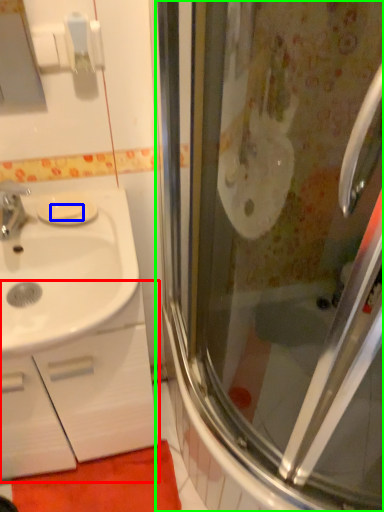
Question: Based on their relative distances, which object is nearer to bathroom cabinet (highlighted by a red box)? Choose from soap (highlighted by a blue box) and screen door (highlighted by a green box).

Choices:
 (A) soap
 (B) screen door

Answer: (B)